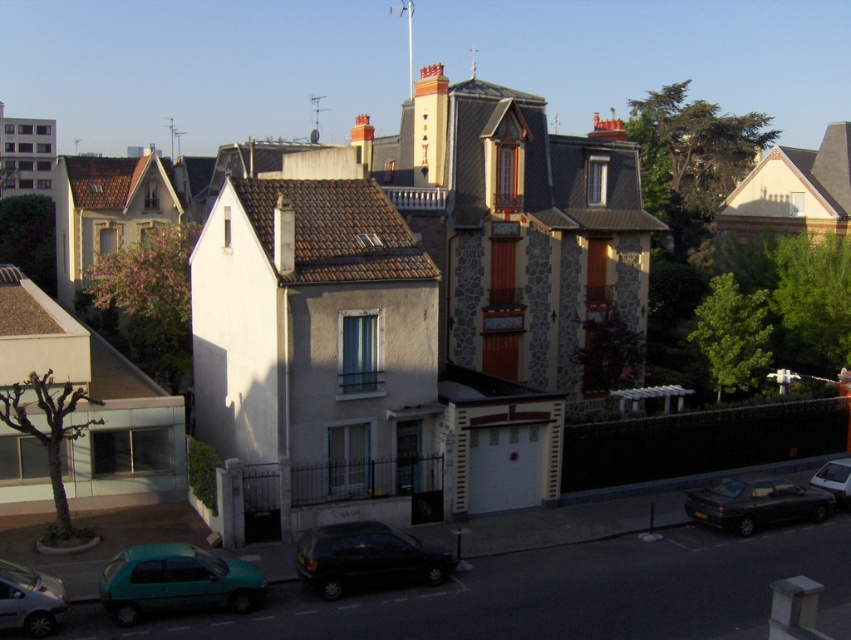
You are standing at the point with coordinates (176, 580) in the residential street scene. What object is located at this coordinate?

The point at coordinates (176, 580) corresponds to the teal matte hatchback at lower left.

In the scene shown: You are a delivery person who needs to park your teal matte hatchback at lower left in a designated parking spot located at coordinates 0.909, 0.208. Is your current position correct?

Yes, the teal matte hatchback at lower left is already positioned at the coordinates (176, 580), so it is correctly parked in the designated parking spot.

You are a delivery person needing to park your 6.5 feet wide van between the teal matte hatchback at lower left and the metallic teal hatchback at lower left. Can you fit your van there?

The distance between the teal matte hatchback at lower left and the metallic teal hatchback at lower left is 7.00 feet. Since your van is 6.5 feet wide, it can fit in the space between them.